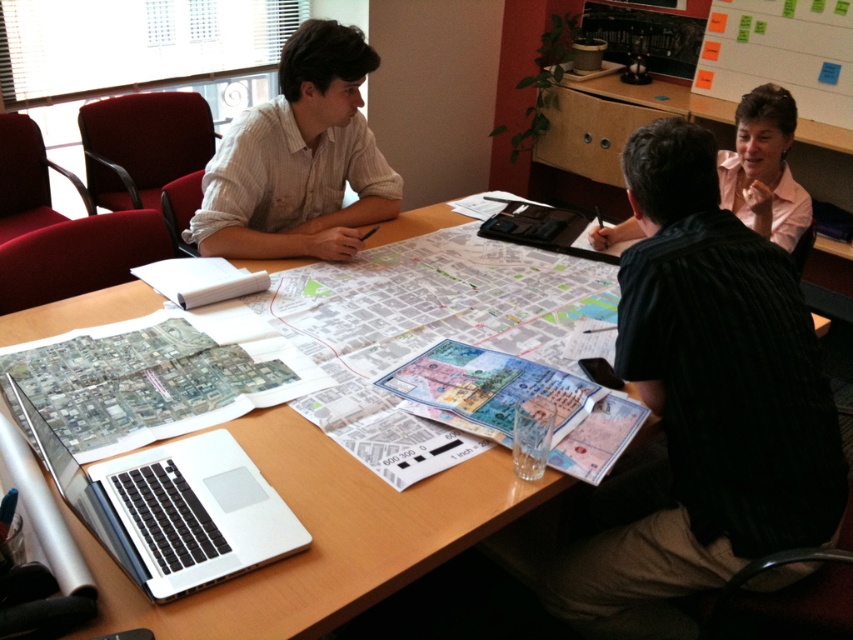
Measure the distance between transparent plastic map at center and camera.

A distance of 1.17 meters exists between transparent plastic map at center and camera.

Is point (380, 385) less distant than point (596, 232)?

Yes.

The width and height of the screenshot is (853, 640). Describe the element at coordinates (517, 403) in the screenshot. I see `transparent plastic map at center` at that location.

Find the location of `transparent plastic map at center`. transparent plastic map at center is located at coordinates (517, 403).

Can you confirm if black velvet shirt at center is thinner than transparent plastic map at center?

Indeed, black velvet shirt at center has a lesser width compared to transparent plastic map at center.

Is point (619, 605) positioned in front of point (572, 404)?

No, it is not.

I want to click on black velvet shirt at center, so click(706, 401).

Between transparent plastic map at lower left and black matte laptop at center, which one appears on the right side from the viewer's perspective?

Positioned to the right is black matte laptop at center.

Who is positioned more to the left, transparent plastic map at lower left or black matte laptop at center?

From the viewer's perspective, transparent plastic map at lower left appears more on the left side.

Is point (271, 401) farther from camera compared to point (579, 246)?

No, it is in front of (579, 246).

The height and width of the screenshot is (640, 853). I want to click on transparent plastic map at lower left, so pos(154,378).